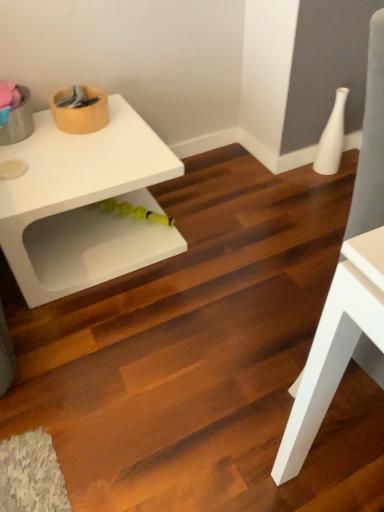
What are the coordinates of `vacant region to the left of white matte table at right, the second table in the back-to-front sequence` in the screenshot? It's located at (241, 409).